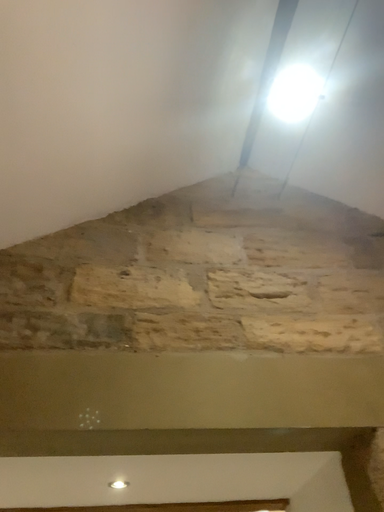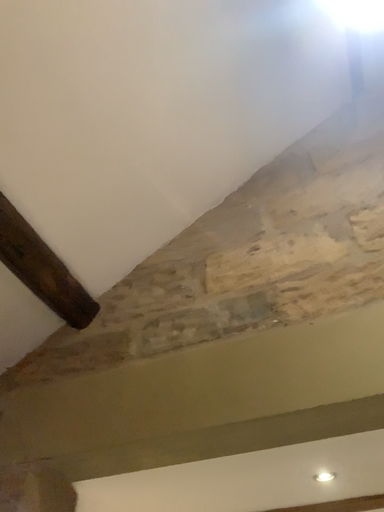
Question: Which way did the camera rotate in the video?

Choices:
 (A) rotated left
 (B) rotated right

Answer: (A)